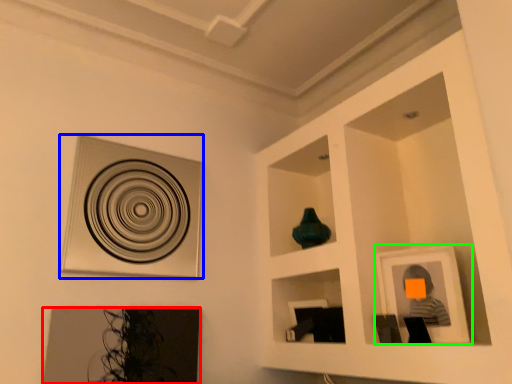
Question: Which object is the closest to the picture frame (highlighted by a red box)? Choose among these: picture frame (highlighted by a blue box) or picture frame (highlighted by a green box).

Choices:
 (A) picture frame
 (B) picture frame

Answer: (A)